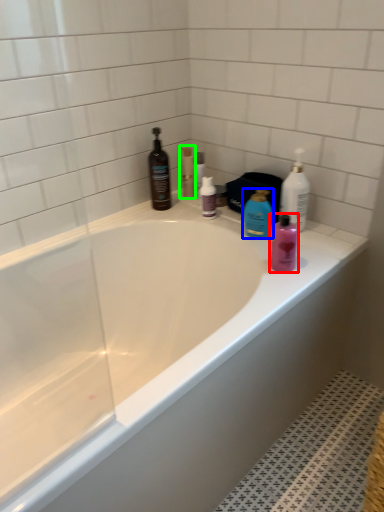
Question: Based on their relative distances, which object is farther from toiletry (highlighted by a red box)? Choose from cleaning product (highlighted by a blue box) and toiletry (highlighted by a green box).

Choices:
 (A) cleaning product
 (B) toiletry

Answer: (B)